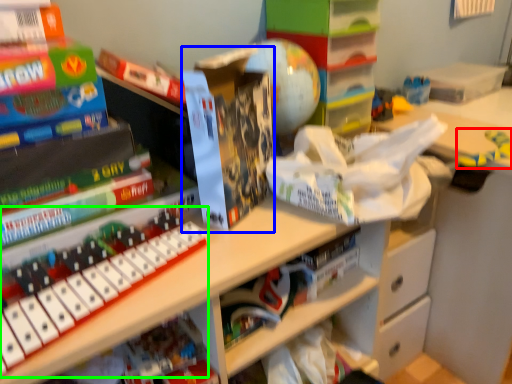
Question: Which object is the closest to the toy (highlighted by a red box)? Choose among these: paperback book (highlighted by a blue box) or musical keyboard (highlighted by a green box).

Choices:
 (A) paperback book
 (B) musical keyboard

Answer: (A)